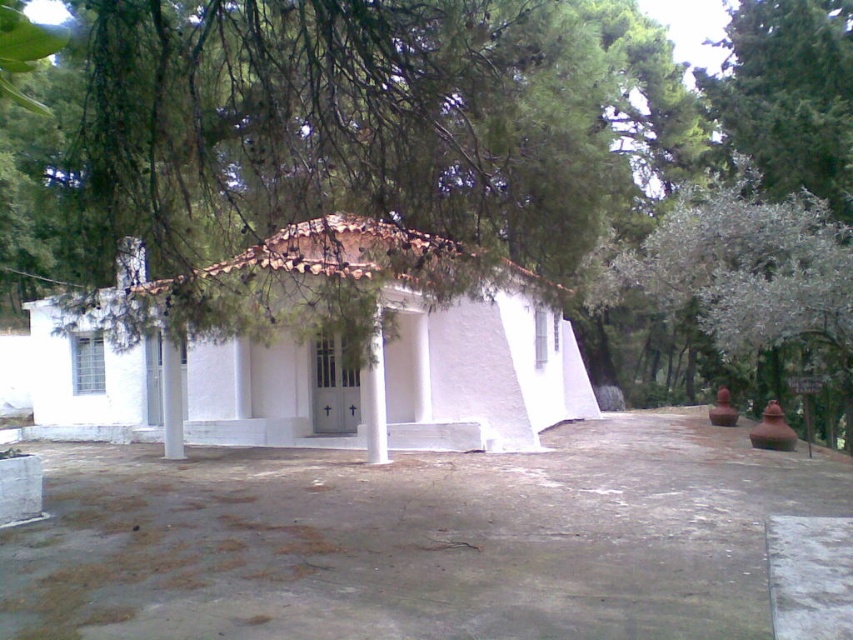
Question: In this image, where is white smooth hut at center located relative to white textured tree at right?

Choices:
 (A) below
 (B) above

Answer: (A)

Question: Does white textured tree at right have a greater width compared to white smooth column at center?

Choices:
 (A) yes
 (B) no

Answer: (A)

Question: Among these objects, which one is farthest from the camera?

Choices:
 (A) green leafy tree at center
 (B) white smooth column at center
 (C) white smooth hut at center
 (D) white textured tree at right

Answer: (B)

Question: Which object is closer to the camera taking this photo?

Choices:
 (A) white smooth hut at center
 (B) white smooth column at center
 (C) white textured tree at right

Answer: (A)

Question: Can you confirm if white smooth hut at center is positioned below white textured tree at right?

Choices:
 (A) yes
 (B) no

Answer: (A)

Question: Among these points, which one is nearest to the camera?

Choices:
 (A) (372, 432)
 (B) (728, 360)
 (C) (231, 115)
 (D) (482, 440)

Answer: (C)